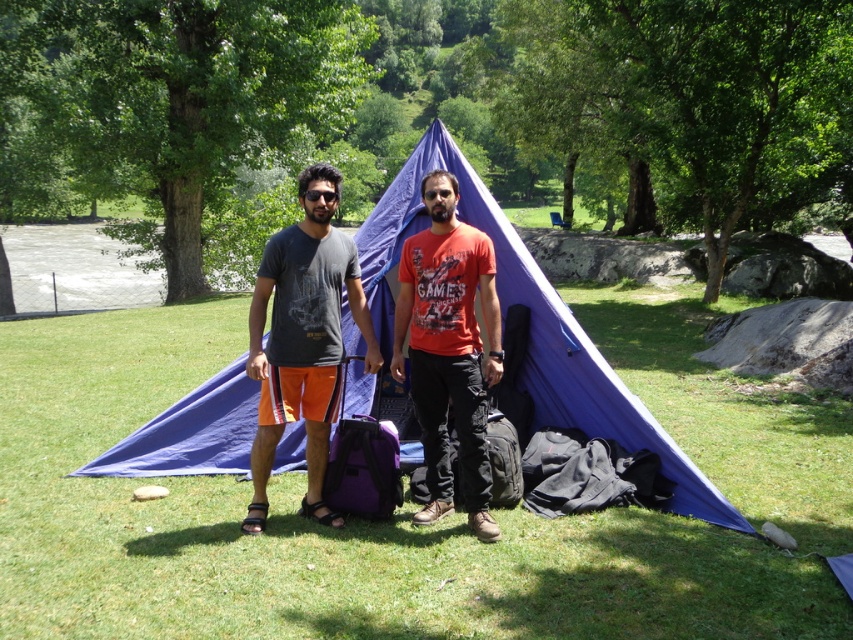
Question: Which object appears closest to the camera in this image?

Choices:
 (A) matte gray t-shirt at center
 (B) matte orange t-shirt at center
 (C) blue fabric tent at center

Answer: (A)

Question: Which point is farther to the camera?

Choices:
 (A) (584, 424)
 (B) (476, 337)
 (C) (294, 228)

Answer: (A)

Question: Is blue fabric tent at center to the left of matte orange t-shirt at center from the viewer's perspective?

Choices:
 (A) no
 (B) yes

Answer: (A)

Question: Is blue fabric tent at center to the left of matte orange t-shirt at center from the viewer's perspective?

Choices:
 (A) no
 (B) yes

Answer: (A)

Question: Among these points, which one is farthest from the camera?

Choices:
 (A) (398, 214)
 (B) (294, 323)

Answer: (A)

Question: Is blue fabric tent at center below matte orange t-shirt at center?

Choices:
 (A) yes
 (B) no

Answer: (B)